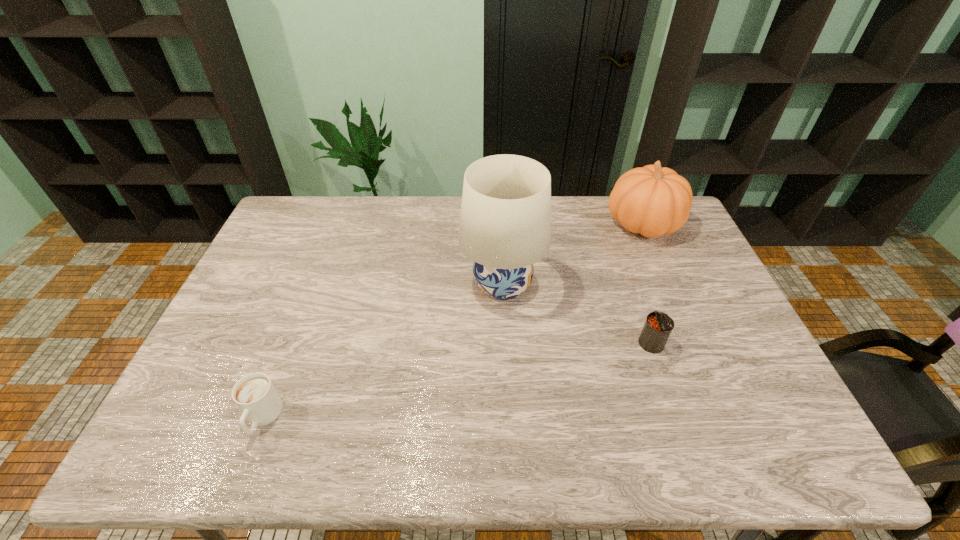
The width and height of the screenshot is (960, 540). In order to click on vacant space located on the front-facing side of the second object from left to right in this screenshot , I will do `click(408, 285)`.

Identify the location of free spot located on the front of the farthest object. The width and height of the screenshot is (960, 540). (670, 287).

The image size is (960, 540). What are the coordinates of `free spot located on the back of the can` in the screenshot? It's located at (618, 247).

The width and height of the screenshot is (960, 540). I want to click on object at the far edge, so click(x=652, y=201).

Locate an element on the screen. The height and width of the screenshot is (540, 960). object positioned at the near edge is located at coordinates (255, 395).

Where is `object present at the right edge`? The image size is (960, 540). object present at the right edge is located at coordinates (652, 201).

Where is `object that is at the far right corner`? The width and height of the screenshot is (960, 540). object that is at the far right corner is located at coordinates (652, 201).

Locate an element on the screen. The height and width of the screenshot is (540, 960). vacant space at the far edge of the desktop is located at coordinates (570, 213).

Locate an element on the screen. This screenshot has width=960, height=540. vacant space at the near edge is located at coordinates (402, 460).

The image size is (960, 540). Find the location of `vacant area at the left edge of the desktop`. vacant area at the left edge of the desktop is located at coordinates (227, 423).